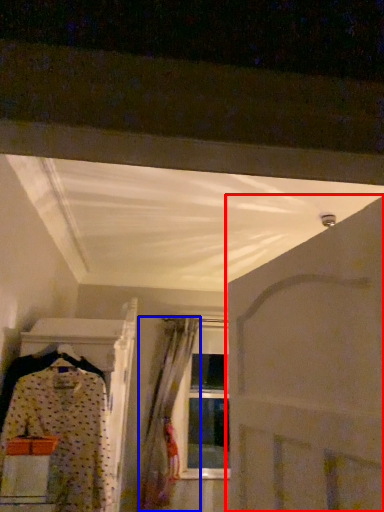
Question: Which object is further to the camera taking this photo, door (highlighted by a red box) or curtain (highlighted by a blue box)?

Choices:
 (A) door
 (B) curtain

Answer: (B)